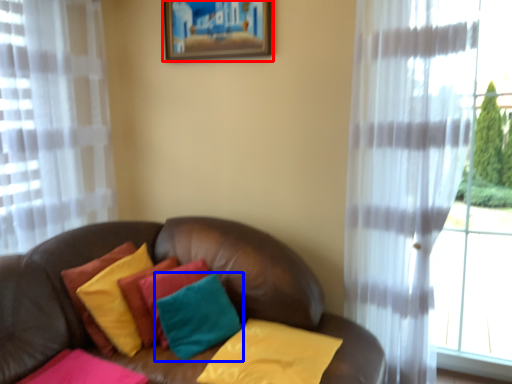
Question: Which object is further to the camera taking this photo, picture frame (highlighted by a red box) or pillow (highlighted by a blue box)?

Choices:
 (A) picture frame
 (B) pillow

Answer: (A)